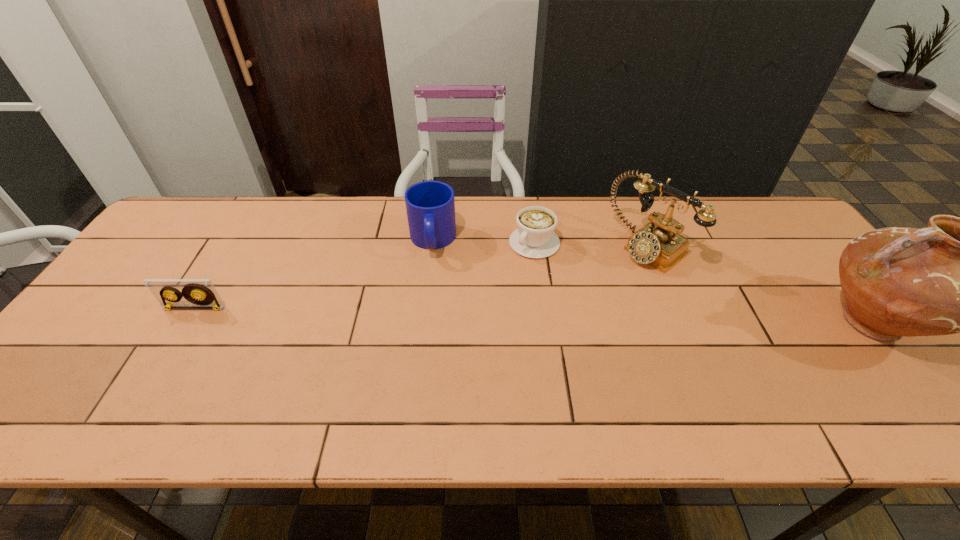
Locate an element on the screen. blank space located on the side with the handle of the mug is located at coordinates [x=427, y=367].

This screenshot has height=540, width=960. In order to click on free location located 0.330m on the side with the handle of the mug in this screenshot , I will do `click(427, 360)`.

Find the location of a particular element. The height and width of the screenshot is (540, 960). free space located 0.220m on the side with the handle of the mug is located at coordinates (429, 323).

Identify the location of vacant space located on the dial number of the telephone. The height and width of the screenshot is (540, 960). (555, 317).

The height and width of the screenshot is (540, 960). In order to click on free space located 0.250m on the dial number of the telephone in this screenshot , I will do `click(568, 307)`.

Image resolution: width=960 pixels, height=540 pixels. I want to click on vacant area situated on the dial number of the telephone, so click(x=530, y=335).

The image size is (960, 540). Identify the location of cappuccino at the far edge. (535, 238).

Find the location of a particular element. The width and height of the screenshot is (960, 540). mug positioned at the far edge is located at coordinates (430, 205).

Locate an element on the screen. telephone that is positioned at the far edge is located at coordinates (658, 243).

Find the location of a particular element. This screenshot has width=960, height=540. object present at the left edge is located at coordinates (198, 293).